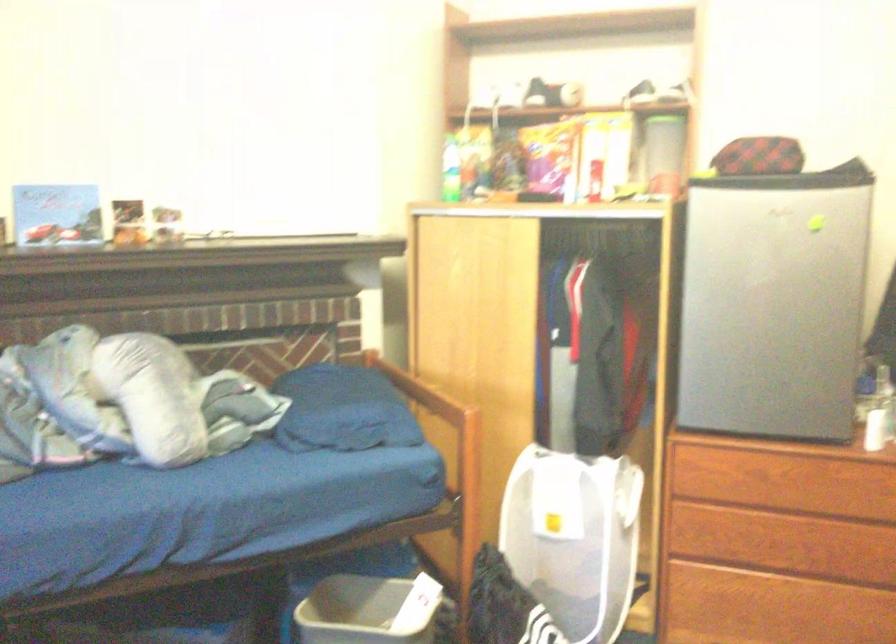
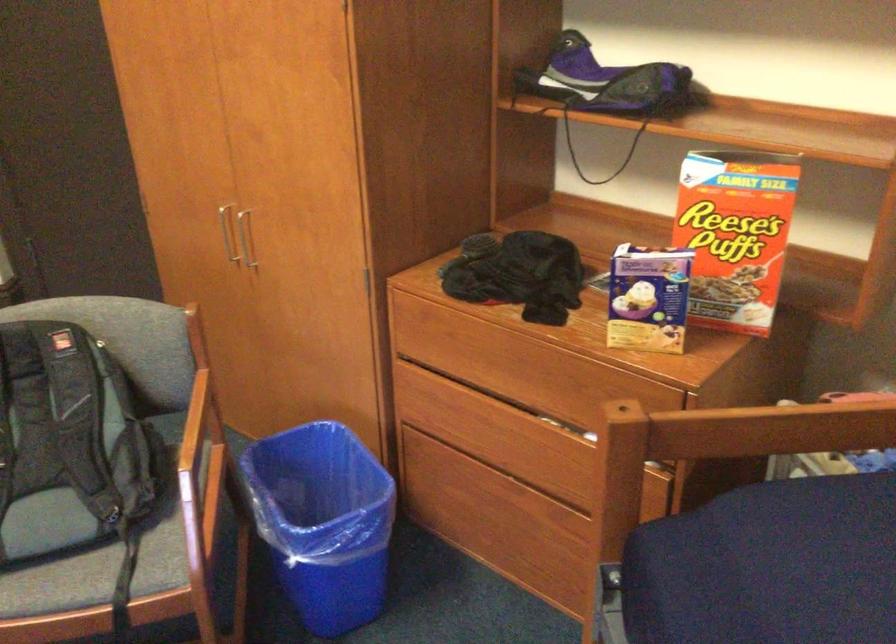
How did the camera likely rotate?

The camera rotated toward right-down.